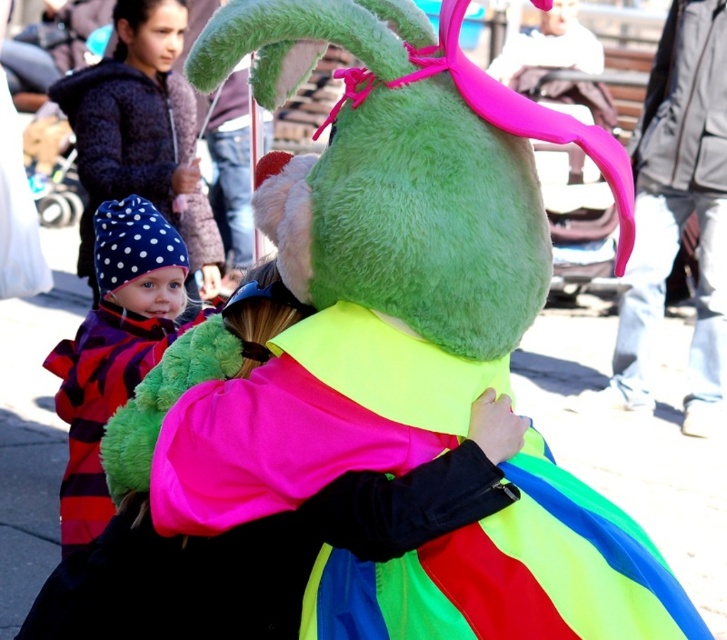
Question: Considering the relative positions of polka dot fabric hat at lower left and polka dot fabric hat at left in the image provided, where is polka dot fabric hat at lower left located with respect to polka dot fabric hat at left?

Choices:
 (A) right
 (B) left

Answer: (B)

Question: Among these points, which one is nearest to the camera?

Choices:
 (A) (87, 512)
 (B) (103, 129)

Answer: (A)

Question: Can you confirm if polka dot fabric hat at lower left is smaller than polka dot fabric hat at left?

Choices:
 (A) yes
 (B) no

Answer: (B)

Question: Does polka dot fabric hat at lower left appear under polka dot fabric hat at left?

Choices:
 (A) no
 (B) yes

Answer: (A)

Question: Which object appears farthest from the camera in this image?

Choices:
 (A) polka dot fabric hat at left
 (B) polka dot fabric hat at lower left

Answer: (B)